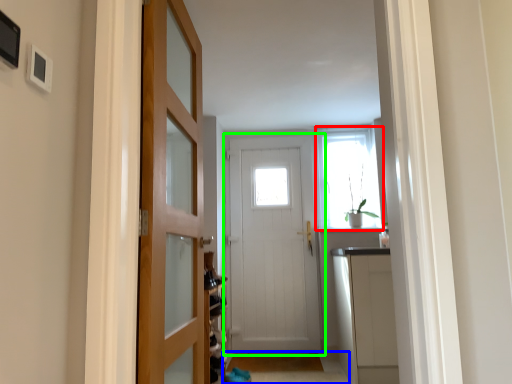
Question: Which object is positioned closest to window (highlighted by a red box)? Select from path (highlighted by a blue box) and door (highlighted by a green box).

Choices:
 (A) path
 (B) door

Answer: (B)